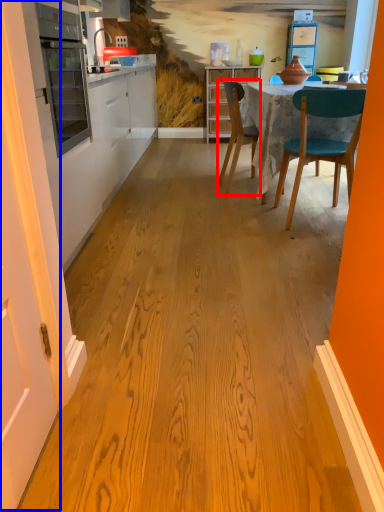
Question: Which object appears closest to the camera in this image, chair (highlighted by a red box) or door (highlighted by a blue box)?

Choices:
 (A) chair
 (B) door

Answer: (B)